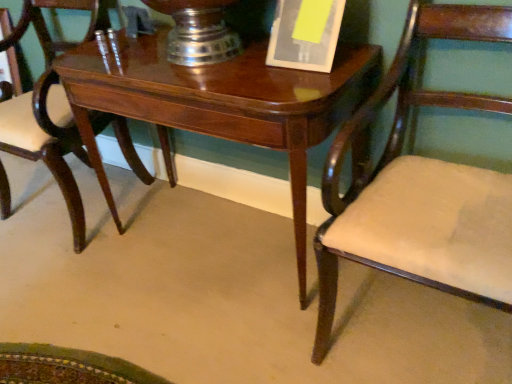
Where is `free space that is in between mahogany wood chair at center, marked as the 1th chair in a left-to-right arrangement, and glossy wood table at center`? free space that is in between mahogany wood chair at center, marked as the 1th chair in a left-to-right arrangement, and glossy wood table at center is located at coordinates (150, 269).